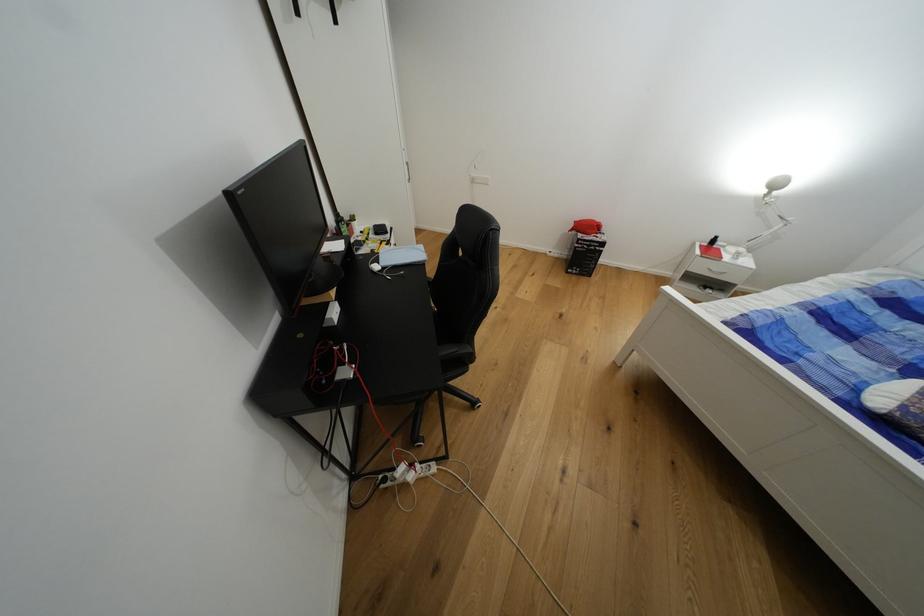
The image size is (924, 616). I want to click on round patterned pillow, so click(x=897, y=403).